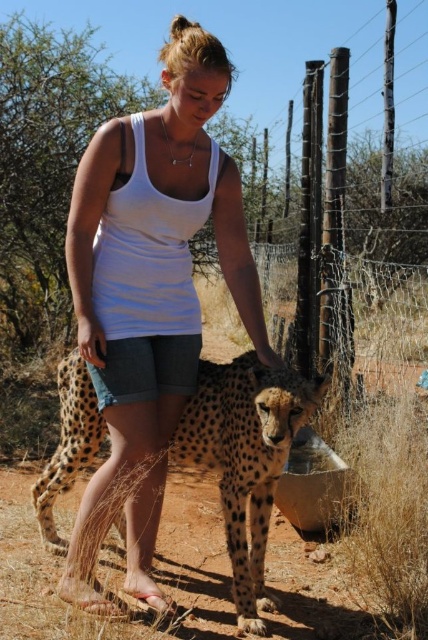
Between point (89, 320) and point (249, 360), which one is positioned in front?

Point (89, 320)

Can you confirm if white fabric tank top at center is taller than spotted fur cheetah at center?

Indeed, white fabric tank top at center has a greater height compared to spotted fur cheetah at center.

Consider the image. Measure the distance between white fabric tank top at center and camera.

They are 8.63 feet apart.

Where is `white fabric tank top at center`? Image resolution: width=428 pixels, height=640 pixels. white fabric tank top at center is located at coordinates (149, 296).